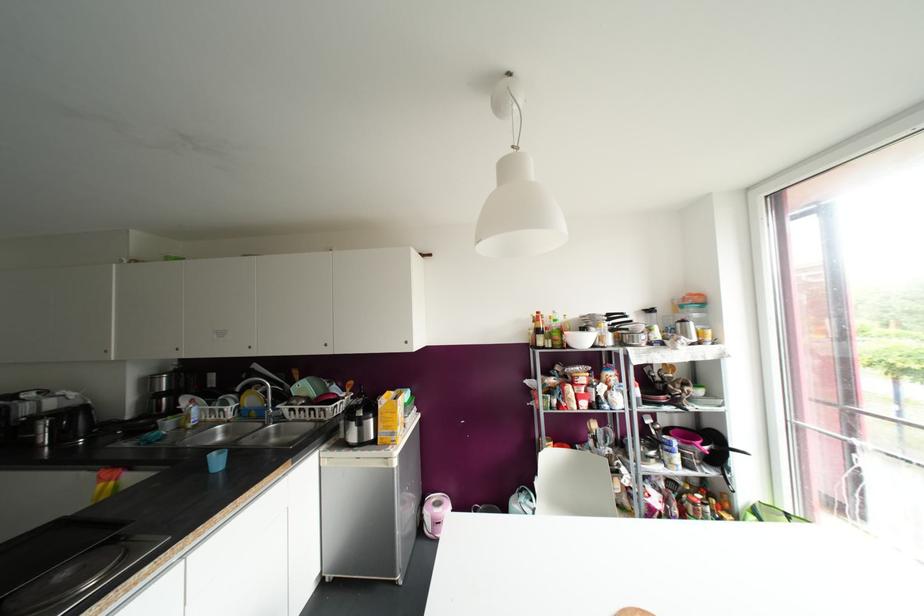
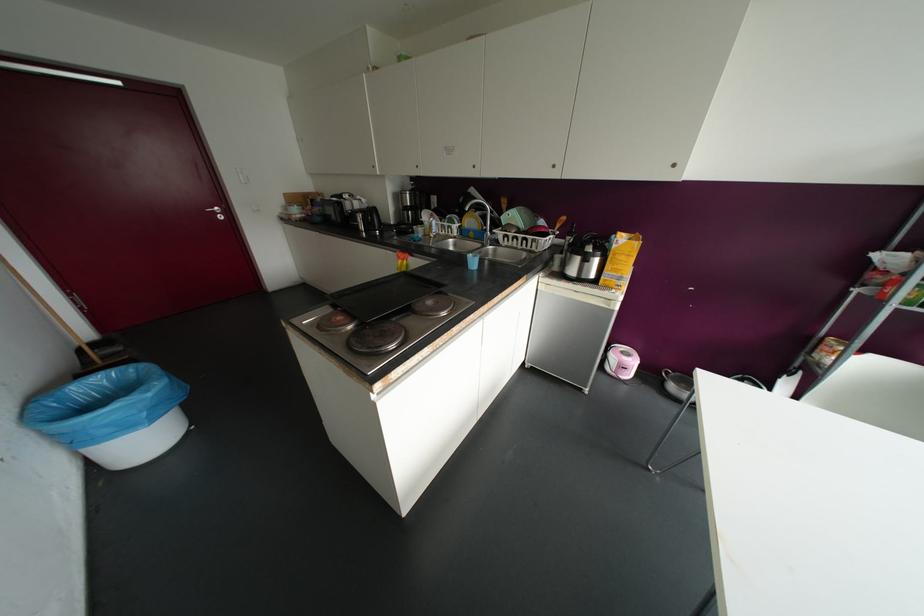
Find the pixel in the second image that matches the point at 250,399 in the first image.

(469, 221)